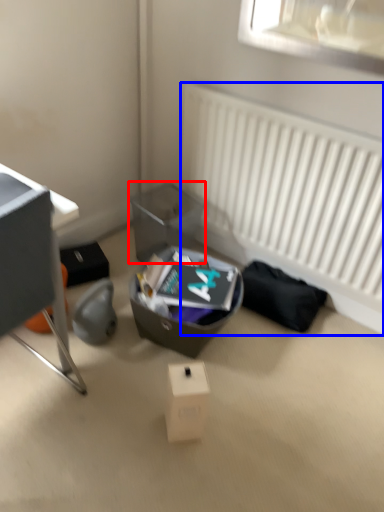
Question: Among these objects, which one is nearest to the camera, shoe box (highlighted by a red box) or radiator (highlighted by a blue box)?

Choices:
 (A) shoe box
 (B) radiator

Answer: (B)